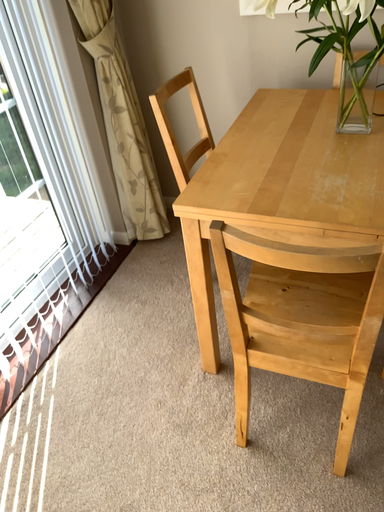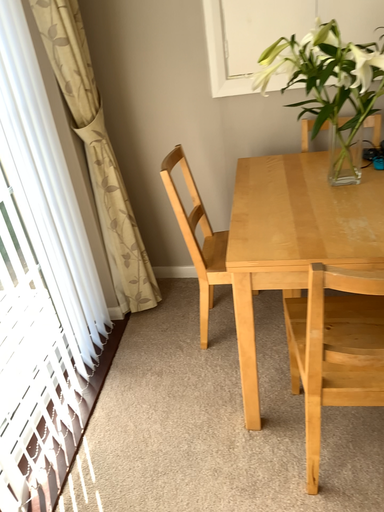
Question: Which way did the camera rotate in the video?

Choices:
 (A) rotated right
 (B) rotated left

Answer: (A)